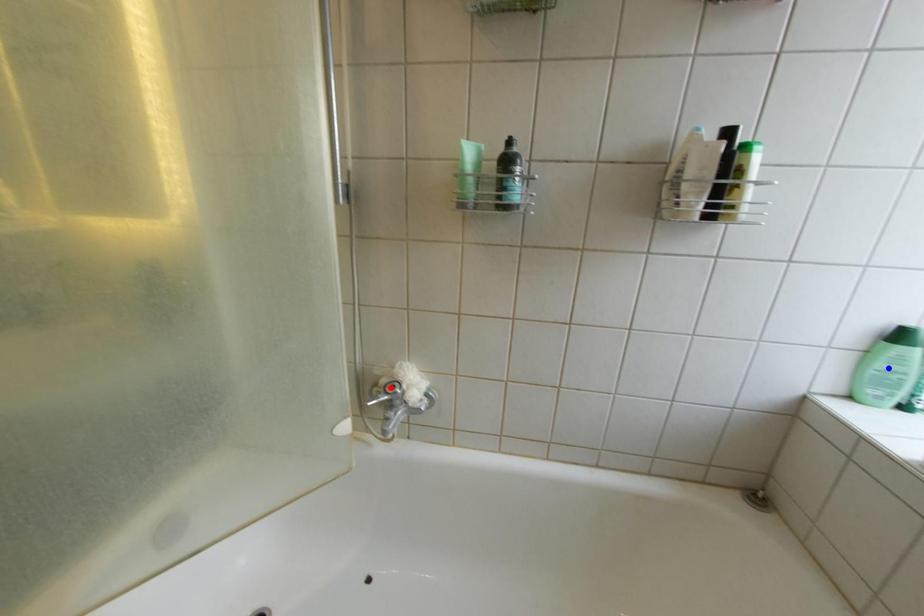
Question: Which of the two points in the image is closer to the camera?

Choices:
 (A) Blue point is closer.
 (B) Red point is closer.

Answer: (A)